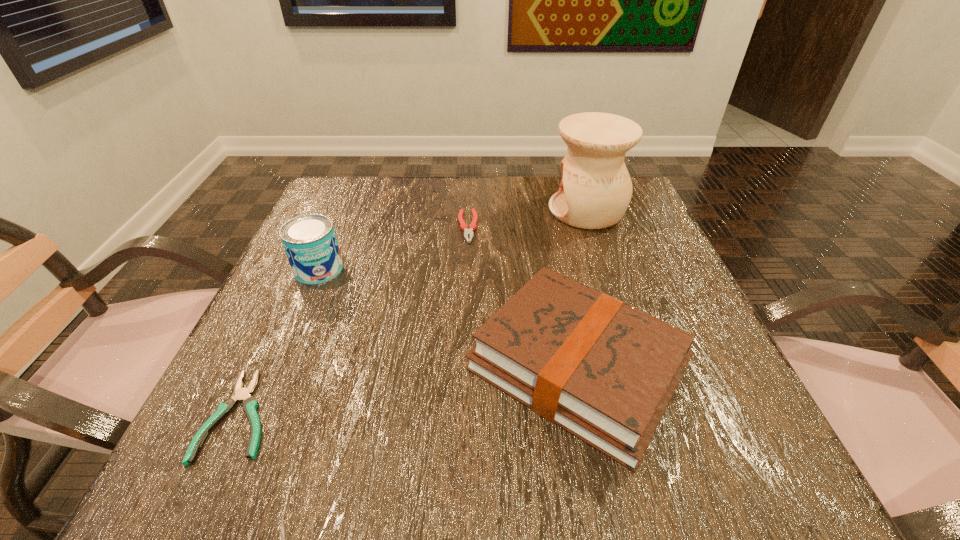
At what (x,y) coordinates should I click in order to perform the action: click on empty location between the shortest object and the farther pliers. Please return your answer as a coordinate pair (x, y). This screenshot has width=960, height=540. Looking at the image, I should click on (354, 321).

The height and width of the screenshot is (540, 960). Find the location of `object that is the fourth nearest to the third shortest object`. object that is the fourth nearest to the third shortest object is located at coordinates (249, 403).

Find the location of a particular element. This screenshot has width=960, height=540. object that is the closest to the third farthest object is located at coordinates (249, 403).

At what (x,y) coordinates should I click in order to perform the action: click on vacant point that satisfies the following two spatial constraints: 1. at the open side of the pottery; 2. on the front side of the hardback book. Please return your answer as a coordinate pair (x, y). This screenshot has width=960, height=540. Looking at the image, I should click on (639, 366).

Identify the location of free space that satisfies the following two spatial constraints: 1. at the open side of the pottery; 2. on the front side of the farther pliers. The width and height of the screenshot is (960, 540). (592, 227).

Where is `vacant space that satisfies the following two spatial constraints: 1. on the back side of the hardback book; 2. on the left side of the shorter pliers`? This screenshot has height=540, width=960. vacant space that satisfies the following two spatial constraints: 1. on the back side of the hardback book; 2. on the left side of the shorter pliers is located at coordinates (264, 366).